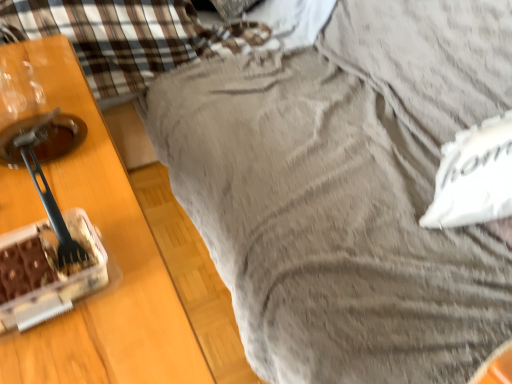
Question: Considering the relative sizes of wooden table at left and white fabric pillow at right in the image provided, is wooden table at left bigger than white fabric pillow at right?

Choices:
 (A) yes
 (B) no

Answer: (A)

Question: Can you confirm if wooden table at left is taller than white fabric pillow at right?

Choices:
 (A) yes
 (B) no

Answer: (A)

Question: Is wooden table at left far from white fabric pillow at right?

Choices:
 (A) yes
 (B) no

Answer: (B)

Question: Is wooden table at left outside white fabric pillow at right?

Choices:
 (A) yes
 (B) no

Answer: (A)

Question: Is wooden table at left looking in the opposite direction of white fabric pillow at right?

Choices:
 (A) no
 (B) yes

Answer: (B)

Question: From the image's perspective, does wooden table at left appear higher than white fabric pillow at right?

Choices:
 (A) no
 (B) yes

Answer: (A)

Question: Would you say white fabric pillow at right contains wooden table at left?

Choices:
 (A) no
 (B) yes

Answer: (A)

Question: Is white fabric pillow at right at the right side of wooden table at left?

Choices:
 (A) no
 (B) yes

Answer: (B)

Question: Can we say white fabric pillow at right lies outside wooden table at left?

Choices:
 (A) no
 (B) yes

Answer: (B)

Question: Is wooden table at left at the back of white fabric pillow at right?

Choices:
 (A) yes
 (B) no

Answer: (B)

Question: Considering the relative sizes of white fabric pillow at right and wooden table at left in the image provided, is white fabric pillow at right smaller than wooden table at left?

Choices:
 (A) no
 (B) yes

Answer: (B)

Question: From the image's perspective, is white fabric pillow at right above wooden table at left?

Choices:
 (A) yes
 (B) no

Answer: (A)

Question: Considering the positions of white fabric pillow at right and wooden table at left in the image, is white fabric pillow at right taller or shorter than wooden table at left?

Choices:
 (A) short
 (B) tall

Answer: (A)